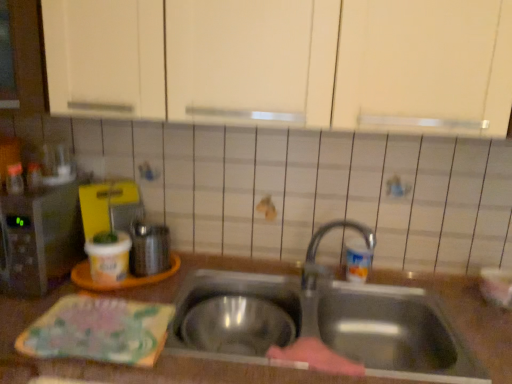
Question: Would you say brown matte countertop at center is part of shiny metallic kettle at left, which ranks as the first appliance in right-to-left order,'s contents?

Choices:
 (A) no
 (B) yes

Answer: (A)

Question: From the image's perspective, would you say shiny metallic kettle at left, which ranks as the first appliance in right-to-left order, is positioned over brown matte countertop at center?

Choices:
 (A) yes
 (B) no

Answer: (A)

Question: Considering the relative positions of shiny metallic kettle at left, the 2th appliance when ordered from left to right, and brown matte countertop at center in the image provided, is shiny metallic kettle at left, the 2th appliance when ordered from left to right, to the left of brown matte countertop at center from the viewer's perspective?

Choices:
 (A) yes
 (B) no

Answer: (A)

Question: From the image's perspective, does shiny metallic kettle at left, the 2th appliance when ordered from left to right, appear lower than brown matte countertop at center?

Choices:
 (A) no
 (B) yes

Answer: (A)

Question: Considering the relative sizes of shiny metallic kettle at left, which ranks as the first appliance in right-to-left order, and brown matte countertop at center in the image provided, is shiny metallic kettle at left, which ranks as the first appliance in right-to-left order, smaller than brown matte countertop at center?

Choices:
 (A) no
 (B) yes

Answer: (B)

Question: Is shiny metallic kettle at left, which ranks as the first appliance in right-to-left order, turned away from brown matte countertop at center?

Choices:
 (A) no
 (B) yes

Answer: (A)

Question: From the image's perspective, would you say brown matte countertop at center is positioned over stainless steel sink at center?

Choices:
 (A) no
 (B) yes

Answer: (A)

Question: Is brown matte countertop at center in contact with stainless steel sink at center?

Choices:
 (A) yes
 (B) no

Answer: (B)

Question: Does brown matte countertop at center turn towards stainless steel sink at center?

Choices:
 (A) yes
 (B) no

Answer: (B)

Question: Is brown matte countertop at center at the left side of stainless steel sink at center?

Choices:
 (A) yes
 (B) no

Answer: (A)

Question: Is stainless steel sink at center located within brown matte countertop at center?

Choices:
 (A) yes
 (B) no

Answer: (A)

Question: Is brown matte countertop at center not within stainless steel sink at center?

Choices:
 (A) yes
 (B) no

Answer: (A)

Question: Does stainless steel sink at center have a smaller size compared to shiny metallic kettle at left, the 2th appliance when ordered from left to right?

Choices:
 (A) no
 (B) yes

Answer: (A)